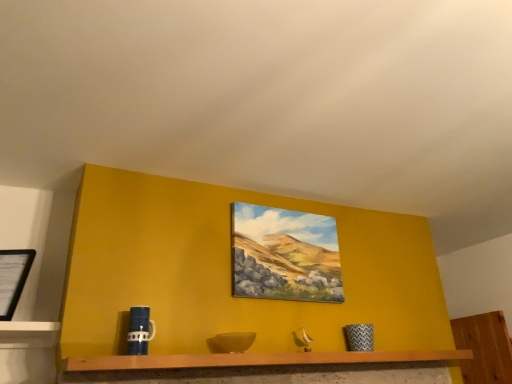
Identify the location of free spot above matte canvas painting at center, the second picture frame in the front-to-back sequence (from a real-world perspective). coord(288,203).